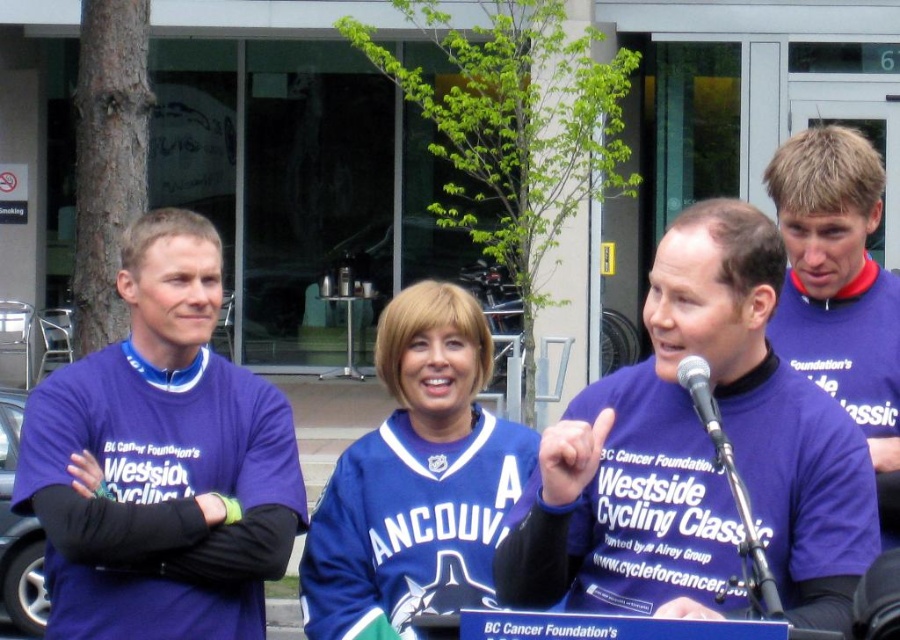
Does purple jersey at right appear over metallic silver microphone at center?

Yes.

Is point (866, 310) farther from camera compared to point (702, 358)?

Yes, point (866, 310) is behind point (702, 358).

Between point (803, 221) and point (708, 413), which one is positioned in front?

Point (708, 413) is in front.

The height and width of the screenshot is (640, 900). I want to click on purple jersey at right, so click(x=840, y=289).

Can you confirm if purple jersey at center is positioned below purple jersey at left?

No, purple jersey at center is not below purple jersey at left.

Can you confirm if purple jersey at center is wider than purple jersey at left?

Yes.

Does point (600, 416) lie in front of point (124, 592)?

Yes, point (600, 416) is in front of point (124, 592).

At what (x,y) coordinates should I click in order to perform the action: click on purple jersey at center. Please return your answer as a coordinate pair (x, y). The height and width of the screenshot is (640, 900). Looking at the image, I should click on (698, 456).

Does purple jersey at left have a greater width compared to purple jersey at right?

Correct, the width of purple jersey at left exceeds that of purple jersey at right.

Can you confirm if purple jersey at left is taller than purple jersey at right?

Indeed, purple jersey at left has a greater height compared to purple jersey at right.

Who is more distant from viewer, [295,534] or [855,332]?

The point [295,534] is more distant.

At what (x,y) coordinates should I click in order to perform the action: click on purple jersey at left. Please return your answer as a coordinate pair (x, y). This screenshot has width=900, height=640. Looking at the image, I should click on (162, 461).